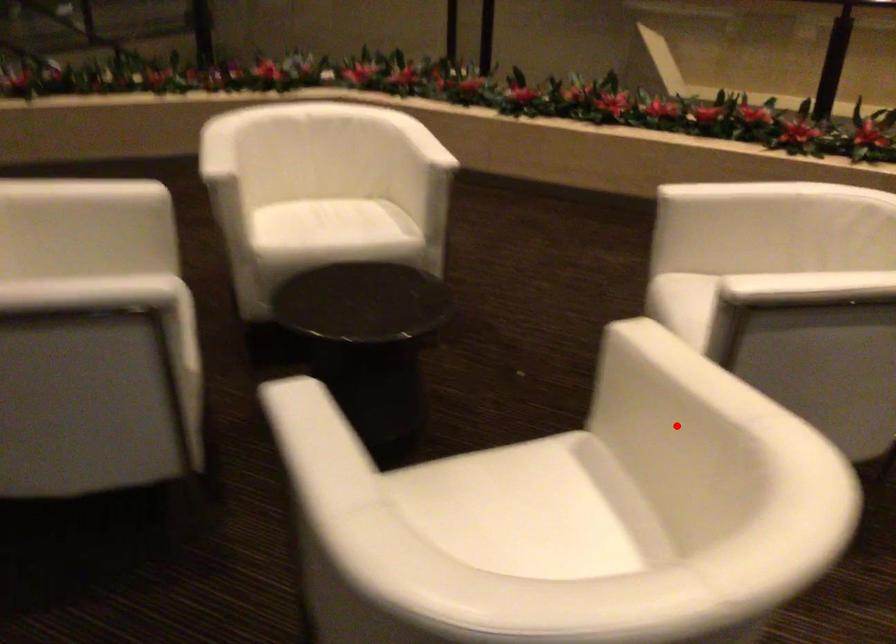
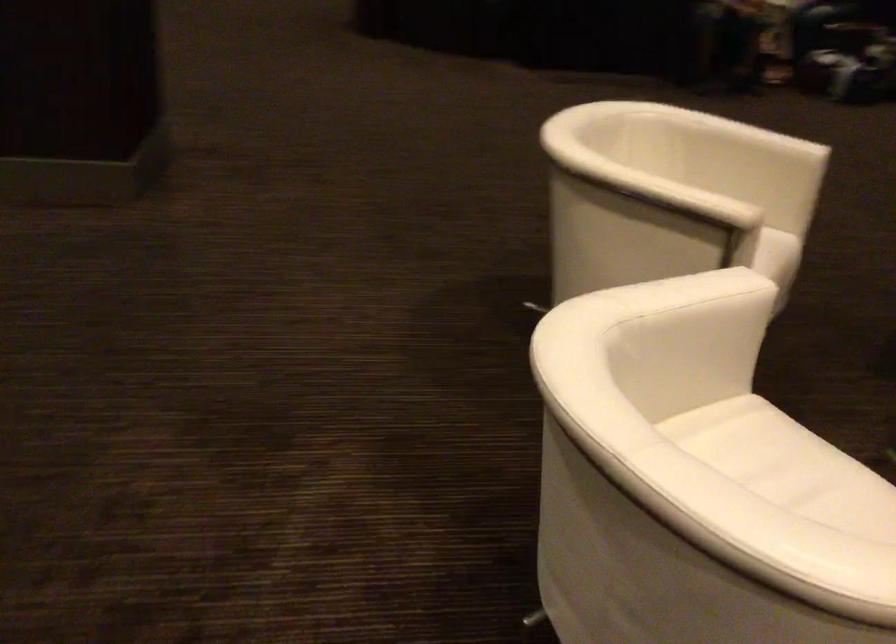
Find the pixel in the second image that matches the highlighted location in the first image.

(676, 261)